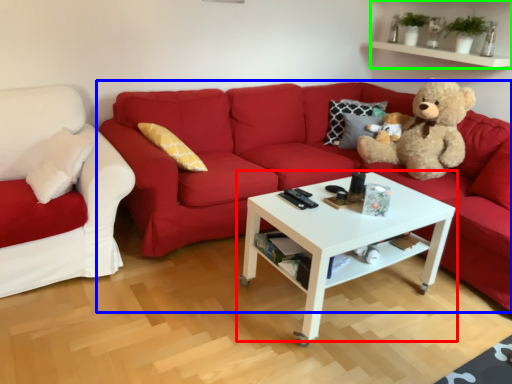
Question: Which is farther away from coffee table (highlighted by a red box)? studio couch (highlighted by a blue box) or shelf (highlighted by a green box)?

Choices:
 (A) studio couch
 (B) shelf

Answer: (B)